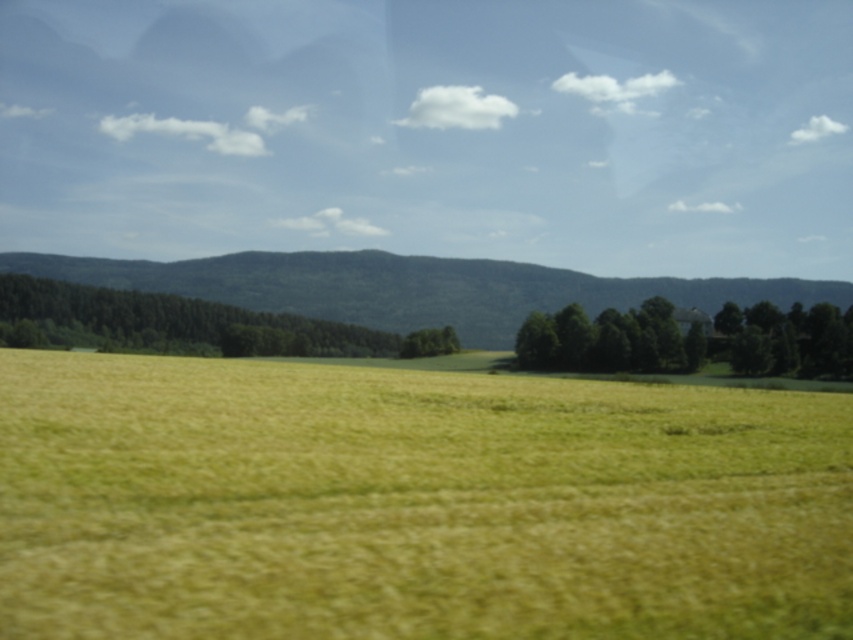
You are standing in the middle of the field of golden grass and see two points marked in the image. The first point is at coordinates point (260, 355) and the second is at point (405, 340). Which point is closer to you?

Point (260, 355) is in front of point (405, 340), so it is closer to you.

From the picture: You are a farmer standing in the middle of the yellow grassy field at center and green leafy trees at center. You want to plant a new row of crops between them. Which direction should you move to ensure the new row is between both objects?

The yellow grassy field at center is positioned over the green leafy trees at center, so you should move downward from the yellow grassy field at center to plant the new row between them.